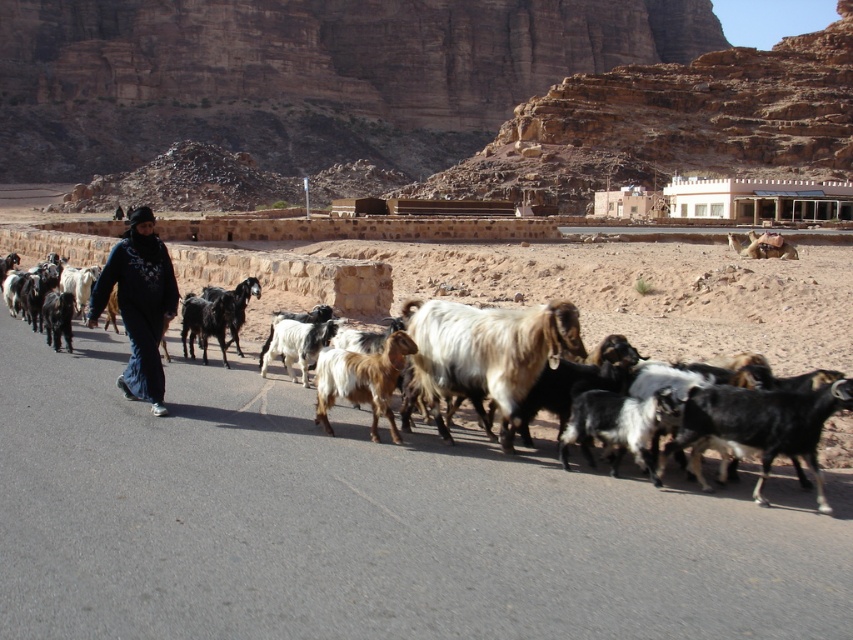
Is white woolen goat at center to the left of black woolen goat at center from the viewer's perspective?

Correct, you'll find white woolen goat at center to the left of black woolen goat at center.

Where is `white woolen goat at center`? white woolen goat at center is located at coordinates (486, 353).

Describe the element at coordinates (758, 426) in the screenshot. This screenshot has width=853, height=640. I see `black woolen goat at center` at that location.

Which is above, black woolen goat at center or shaggy brown goat at center?

shaggy brown goat at center is higher up.

Who is more forward, (831, 392) or (601, 401)?

Point (831, 392)

Identify the location of black woolen goat at center. (758, 426).

Which is more to the right, fluffy brown sheep at center or brown woolen goat at center?

fluffy brown sheep at center is more to the right.

Between point (577, 257) and point (335, 388), which one is positioned in front?

Point (335, 388) is more forward.

I want to click on fluffy brown sheep at center, so click(x=648, y=292).

At what (x,y) coordinates should I click in order to perform the action: click on fluffy brown sheep at center. Please return your answer as a coordinate pair (x, y). Image resolution: width=853 pixels, height=640 pixels. Looking at the image, I should click on (648, 292).